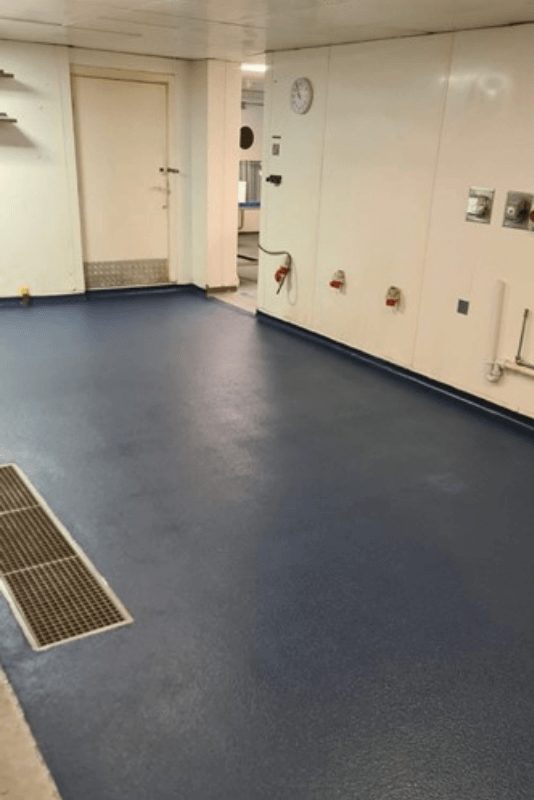
Where is `switch`? switch is located at coordinates (274, 150).